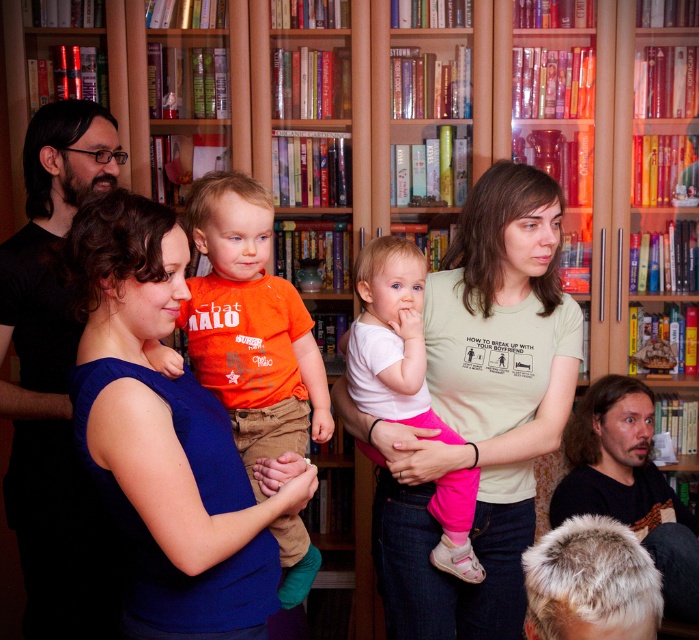
What do you see at coordinates (52, 381) in the screenshot? Image resolution: width=699 pixels, height=640 pixels. I see `black matte shirt at left` at bounding box center [52, 381].

Image resolution: width=699 pixels, height=640 pixels. I want to click on black matte shirt at left, so click(x=52, y=381).

Where is `black matte shirt at left`? This screenshot has height=640, width=699. black matte shirt at left is located at coordinates (52, 381).

Who is more forward, (266,436) or (470,556)?

Point (266,436)

Does orange cotton shirt at center appear on the left side of white cotton shirt at center?

Correct, you'll find orange cotton shirt at center to the left of white cotton shirt at center.

Image resolution: width=699 pixels, height=640 pixels. I want to click on orange cotton shirt at center, so click(250, 324).

In the scene shown: Between light green t-shirt at center and orange cotton shirt at center, which one has more height?

Standing taller between the two is light green t-shirt at center.

Is point (473, 595) positioned behind point (284, 305)?

Yes, point (473, 595) is behind point (284, 305).

Is point (394, 515) positioned after point (319, 417)?

Yes, point (394, 515) is farther from viewer.

You are a GUI agent. You are given a task and a screenshot of the screen. Output one action in this format:
    pyautogui.click(x=<x>, y=<y>)
    Task: Click on the light green t-shirt at center
    This screenshot has width=699, height=640.
    Given the screenshot: What is the action you would take?
    pyautogui.click(x=477, y=408)